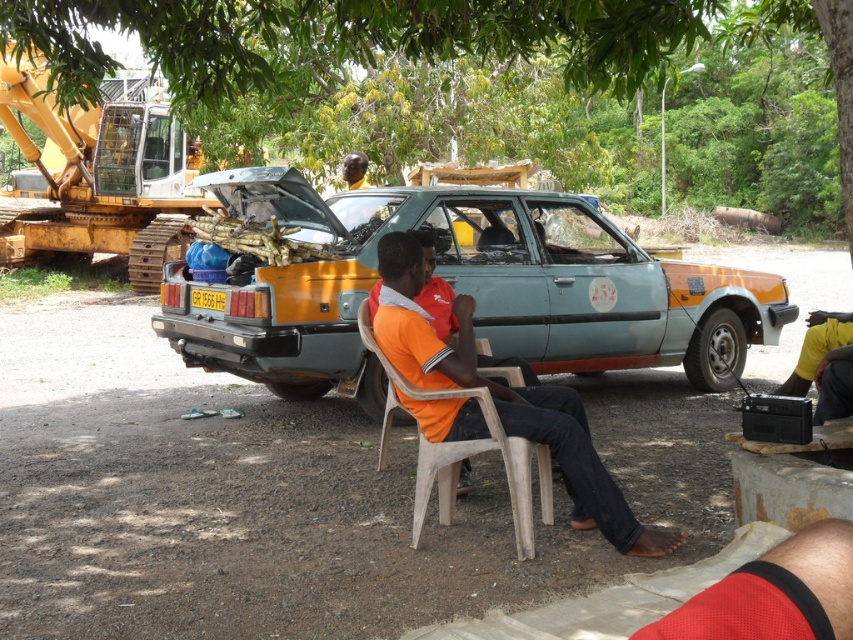
Question: Which point is closer to the camera?

Choices:
 (A) (460, 388)
 (B) (465, 385)

Answer: (B)

Question: Which of the following is the closest to the observer?

Choices:
 (A) (434, 406)
 (B) (45, 195)
 (C) (396, 12)

Answer: (A)

Question: Does green leafy tree at upper center lie in front of white plastic chair at center?

Choices:
 (A) yes
 (B) no

Answer: (B)

Question: Can you confirm if green leafy tree at upper center is positioned below orange fabric shirt at center?

Choices:
 (A) yes
 (B) no

Answer: (B)

Question: Does teal matte car at center have a greater width compared to white plastic chair at center?

Choices:
 (A) yes
 (B) no

Answer: (A)

Question: Which of the following is the closest to the observer?

Choices:
 (A) (570, 433)
 (B) (672, 296)
 (C) (422, 388)
 (D) (131, 280)

Answer: (A)